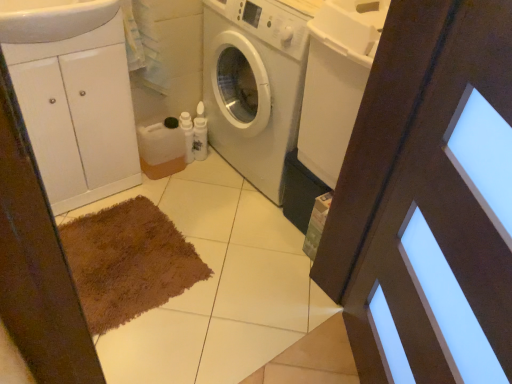
Question: From the image's perspective, would you say white glossy cabinet at left is positioned over white matte washing machine at center?

Choices:
 (A) no
 (B) yes

Answer: (A)

Question: Is white glossy cabinet at left located outside white matte washing machine at center?

Choices:
 (A) no
 (B) yes

Answer: (B)

Question: Does white glossy cabinet at left have a greater height compared to white matte washing machine at center?

Choices:
 (A) no
 (B) yes

Answer: (A)

Question: From a real-world perspective, is white glossy cabinet at left located higher than white matte washing machine at center?

Choices:
 (A) yes
 (B) no

Answer: (A)

Question: Considering the relative positions of white glossy cabinet at left and white matte washing machine at center in the image provided, is white glossy cabinet at left to the left of white matte washing machine at center from the viewer's perspective?

Choices:
 (A) no
 (B) yes

Answer: (B)

Question: Is the depth of white glossy cabinet at left less than that of white matte washing machine at center?

Choices:
 (A) yes
 (B) no

Answer: (A)

Question: Considering the relative sizes of brown wooden screen door at center and white glossy cabinet at left in the image provided, is brown wooden screen door at center bigger than white glossy cabinet at left?

Choices:
 (A) no
 (B) yes

Answer: (B)

Question: Is the depth of brown wooden screen door at center greater than that of white glossy cabinet at left?

Choices:
 (A) no
 (B) yes

Answer: (A)

Question: Is brown wooden screen door at center positioned before white glossy cabinet at left?

Choices:
 (A) no
 (B) yes

Answer: (B)

Question: Considering the relative sizes of brown wooden screen door at center and white glossy cabinet at left in the image provided, is brown wooden screen door at center shorter than white glossy cabinet at left?

Choices:
 (A) yes
 (B) no

Answer: (B)

Question: Is brown wooden screen door at center aimed at white glossy cabinet at left?

Choices:
 (A) no
 (B) yes

Answer: (A)

Question: Would you say white glossy cabinet at left is part of brown wooden screen door at center's contents?

Choices:
 (A) yes
 (B) no

Answer: (B)

Question: From a real-world perspective, is white glossy cabinet at left under white glossy sink at upper left?

Choices:
 (A) yes
 (B) no

Answer: (A)